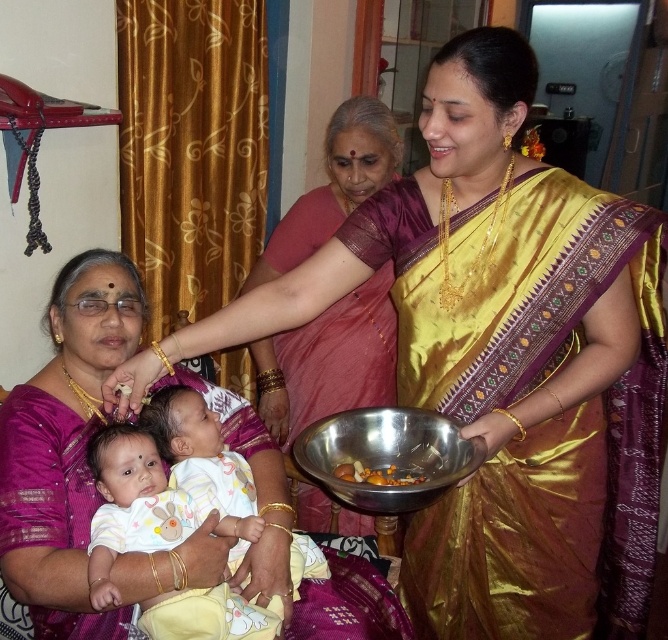
Question: Based on their relative distances, which object is farther from the silky pink saree at center?

Choices:
 (A) white cotton baby at center
 (B) shiny metallic bowl at center
 (C) metallic bowl at center

Answer: (A)

Question: Observing the image, what is the correct spatial positioning of silky pink saree at center in reference to white cotton baby at center?

Choices:
 (A) right
 (B) left

Answer: (A)

Question: Which of the following is the closest to the observer?

Choices:
 (A) (212, 624)
 (B) (403, 410)
 (C) (407, 476)

Answer: (A)

Question: Can you confirm if silky pink saree at center is positioned below metallic bowl at center?

Choices:
 (A) no
 (B) yes

Answer: (A)

Question: Based on their relative distances, which object is farther from the white cotton baby at center?

Choices:
 (A) metallic bowl at center
 (B) shiny metallic bowl at center
 (C) silky pink saree at center

Answer: (C)

Question: Where is silky pink saree at center located in relation to shiny metallic bowl at center in the image?

Choices:
 (A) right
 (B) left

Answer: (B)